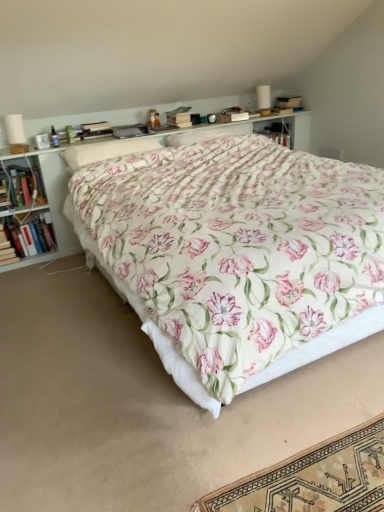
Question: Is point (23, 246) closer or farther from the camera than point (92, 145)?

Choices:
 (A) farther
 (B) closer

Answer: (A)

Question: Considering their positions, is hardcover book at left, arranged as the 2th book when ordered from the bottom, located in front of or behind floral fabric pillow at center, positioned as the second pillow in right-to-left order?

Choices:
 (A) behind
 (B) front

Answer: (A)

Question: Estimate the real-world distances between objects in this image. Which object is farther from the hardcover book at left, placed as the 3th book when sorted from top to bottom?

Choices:
 (A) floral fabric pillow at center, which is the 1th pillow from right to left
 (B) floral cotton bed at center
 (C) hardcover book at left, arranged as the second book when viewed from the top
 (D) white wood shelf at upper center
 (E) hardcover book at left, the 3th book positioned from the bottom

Answer: (B)

Question: Estimate the real-world distances between objects in this image. Which object is farther from the hardcover book at left, the 3th book positioned from the bottom?

Choices:
 (A) floral fabric pillow at center, which ranks as the second pillow in left-to-right order
 (B) floral cotton bed at center
 (C) hardcover book at left, placed as the 3th book when sorted from top to bottom
 (D) hardcover book at left, arranged as the 2th book when ordered from the bottom
 (E) floral fabric pillow at center, positioned as the second pillow in right-to-left order

Answer: (B)